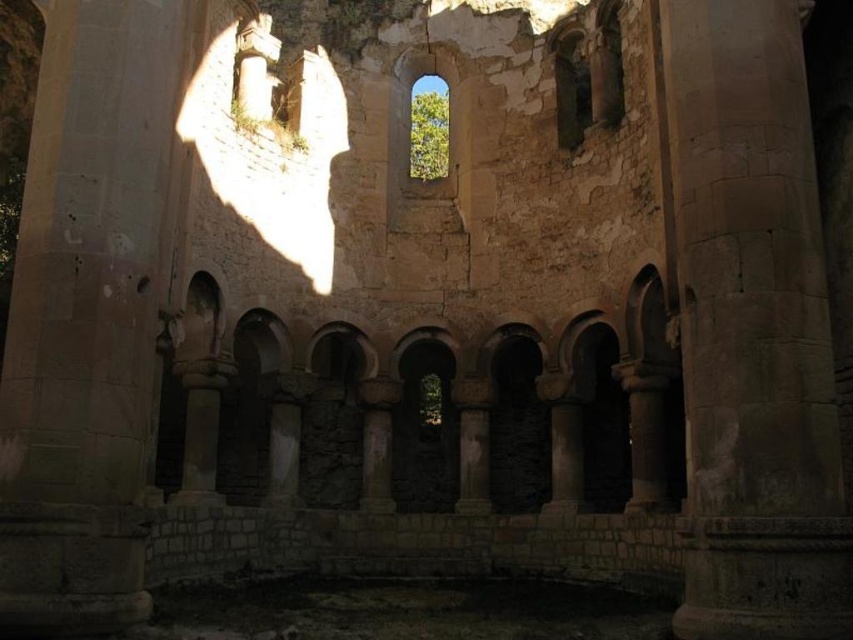
The width and height of the screenshot is (853, 640). Describe the element at coordinates (753, 330) in the screenshot. I see `gray stone column at center` at that location.

Is point (727, 516) less distant than point (439, 160)?

That is True.

Does point (822, 428) lie behind point (432, 99)?

No, it is not.

Where is `gray stone column at center`? This screenshot has height=640, width=853. gray stone column at center is located at coordinates (753, 330).